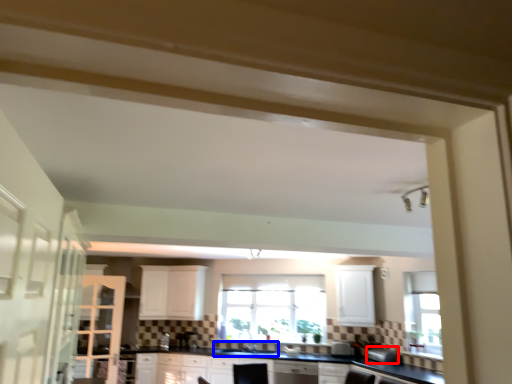
Question: Which object appears closest to the camera in this image, appliance (highlighted by a red box) or sink (highlighted by a blue box)?

Choices:
 (A) appliance
 (B) sink

Answer: (A)